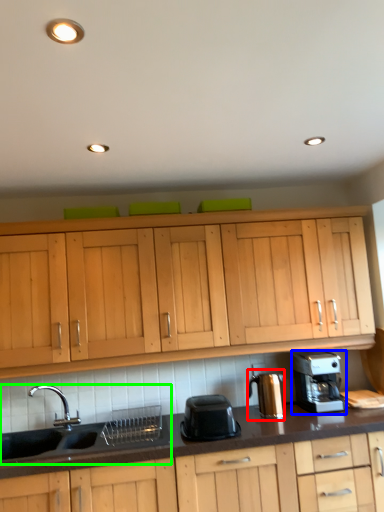
Question: Which is farther away from coffee machine (highlighted by a red box)? home appliance (highlighted by a blue box) or sink (highlighted by a green box)?

Choices:
 (A) home appliance
 (B) sink

Answer: (B)